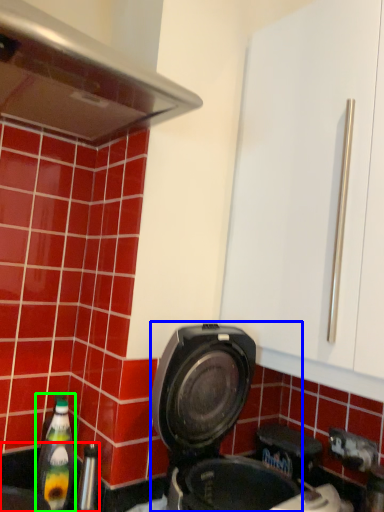
Question: Estimate the real-world distances between objects in this image. Which object is closer to sink (highlighted by a red box), kitchen appliance (highlighted by a blue box) or bottle (highlighted by a green box)?

Choices:
 (A) kitchen appliance
 (B) bottle

Answer: (B)